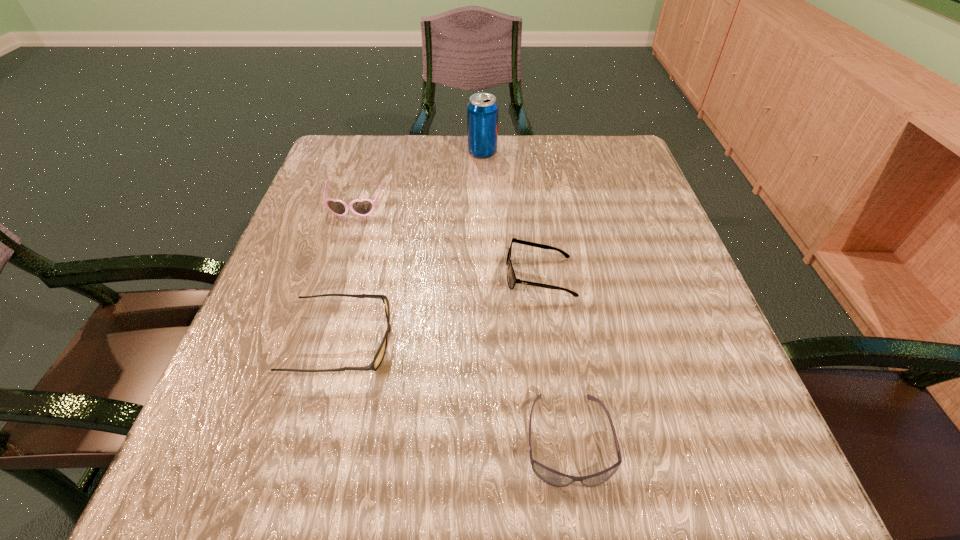
The image size is (960, 540). What are the coordinates of `empty location between the third object from right to left and the second nearest sunglasses` in the screenshot? It's located at (413, 247).

Select which object is the fourth closest to the second nearest sunglasses. Please provide its 2D coordinates. Your answer should be formatted as a tuple, i.e. [(x, y)], where the tuple contains the x and y coordinates of a point satisfying the conditions above.

[(482, 110)]

The width and height of the screenshot is (960, 540). What are the coordinates of `object that is the fourth closest to the farthest sunglasses` in the screenshot? It's located at click(552, 477).

In order to click on sunglasses that can be found as the closest to the nearest sunglasses in this screenshot , I will do `click(511, 277)`.

Identify which sunglasses is the nearest to the farthest sunglasses. Please provide its 2D coordinates. Your answer should be formatted as a tuple, i.e. [(x, y)], where the tuple contains the x and y coordinates of a point satisfying the conditions above.

[(380, 354)]